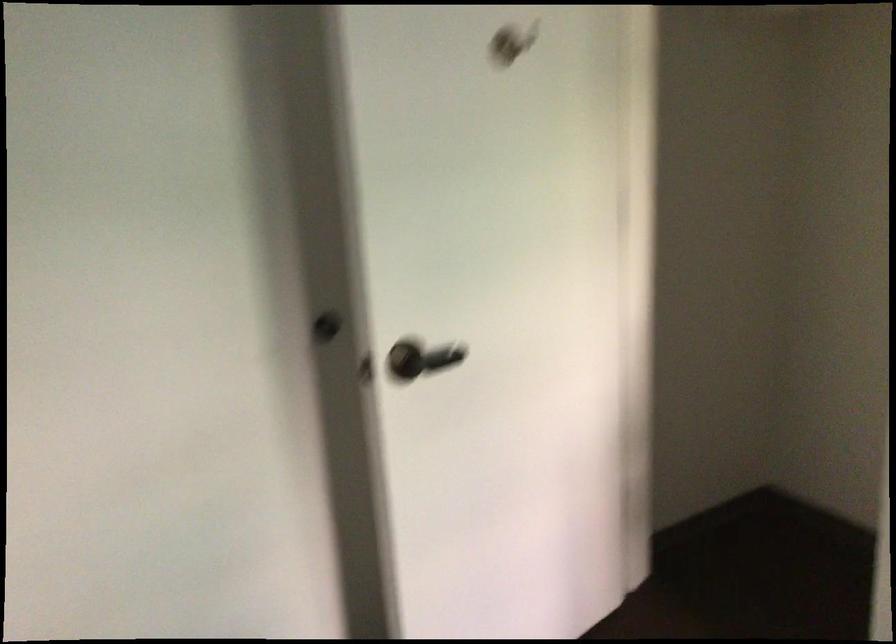
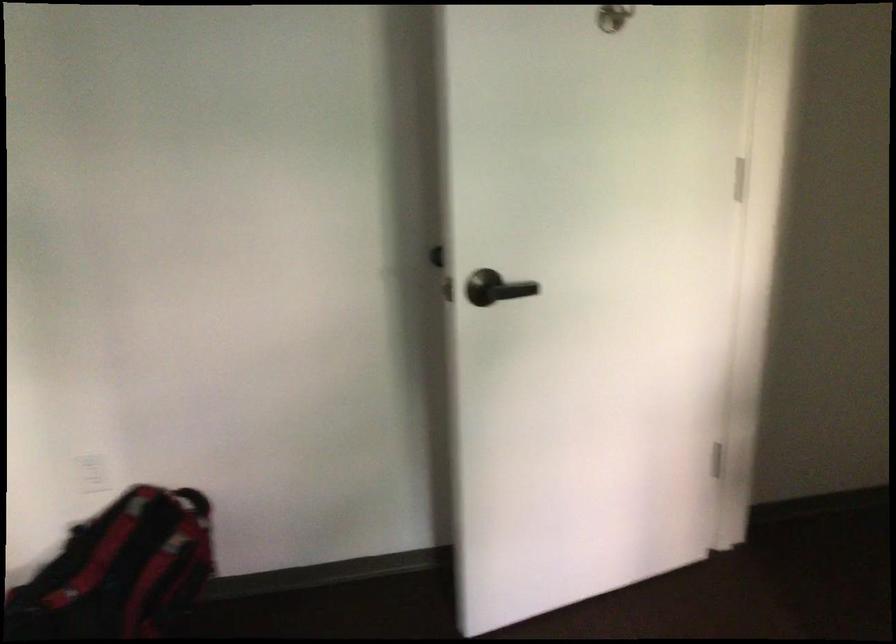
The images are taken continuously from a first-person perspective. In which direction are you moving?

The movement direction of the cameraman is right, backward.